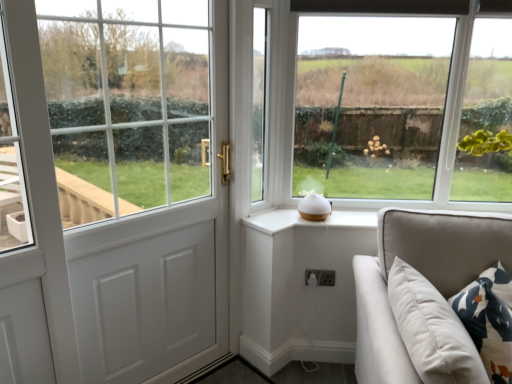
This screenshot has width=512, height=384. What do you see at coordinates (420, 272) in the screenshot?
I see `beige fabric couch at lower right` at bounding box center [420, 272].

Identify the location of white plastic electric outlet at lower center. (319, 277).

Image resolution: width=512 pixels, height=384 pixels. I want to click on beige fabric couch at lower right, so click(x=420, y=272).

Can you confirm if white glass door at left, arranged as the 1th window when viewed from the left, is thinner than white glass window at center, the 2th window viewed from the left?

Incorrect, the width of white glass door at left, arranged as the 1th window when viewed from the left, is not less than that of white glass window at center, the 2th window viewed from the left.

I want to click on window on the left side of white glass window at center, the 2th window viewed from the left, so click(x=127, y=103).

Is white glass window at center, which is the 2th window from right to left, at the back of white glass door at left, the third window when ordered from right to left?

That's not correct — white glass door at left, the third window when ordered from right to left, is not looking away from white glass window at center, which is the 2th window from right to left.

Based on their sizes in the image, would you say white glass door at left, the third window when ordered from right to left, is bigger or smaller than white glass window at center, the 2th window viewed from the left?

white glass door at left, the third window when ordered from right to left, is bigger than white glass window at center, the 2th window viewed from the left.

Are white plastic electric outlet at lower center and white glass door at left, arranged as the 1th window when viewed from the left, making contact?

white plastic electric outlet at lower center and white glass door at left, arranged as the 1th window when viewed from the left, are not in contact.

Considering the sizes of objects white plastic electric outlet at lower center and white glass door at left, arranged as the 1th window when viewed from the left, in the image provided, who is bigger, white plastic electric outlet at lower center or white glass door at left, arranged as the 1th window when viewed from the left,?

white glass door at left, arranged as the 1th window when viewed from the left, is bigger.

From a real-world perspective, is white plastic electric outlet at lower center positioned above or below white glass door at left, the third window when ordered from right to left?

Clearly, from a real-world perspective, white plastic electric outlet at lower center is below white glass door at left, the third window when ordered from right to left.

From the image's perspective, which one is positioned lower, beige fabric couch at lower right or white glass door at left, the third window when ordered from right to left?

beige fabric couch at lower right.

Is beige fabric couch at lower right completely or partially outside of white glass door at left, arranged as the 1th window when viewed from the left?

beige fabric couch at lower right is positioned outside white glass door at left, arranged as the 1th window when viewed from the left.

Does beige fabric couch at lower right appear on the right side of white glass door at left, arranged as the 1th window when viewed from the left?

Correct, you'll find beige fabric couch at lower right to the right of white glass door at left, arranged as the 1th window when viewed from the left.

Looking at this image, is white glass door at left, the third window when ordered from right to left, touching beige fabric couch at lower right?

No.

Considering the sizes of objects white glass door at left, the third window when ordered from right to left, and beige fabric couch at lower right in the image provided, who is smaller, white glass door at left, the third window when ordered from right to left, or beige fabric couch at lower right?

Smaller between the two is beige fabric couch at lower right.

Is white glass door at left, arranged as the 1th window when viewed from the left, behind beige fabric couch at lower right?

Yes, it is behind beige fabric couch at lower right.

How different are the orientations of white glass door at left, arranged as the 1th window when viewed from the left, and beige fabric couch at lower right in degrees?

12.1 degrees.

From the picture: Choose the correct answer: Is white glass door at left, arranged as the 1th window when viewed from the left, inside white plastic electric outlet at lower center or outside it?

white glass door at left, arranged as the 1th window when viewed from the left, cannot be found inside white plastic electric outlet at lower center.

From a real-world perspective, is white glass door at left, the third window when ordered from right to left, under white plastic electric outlet at lower center?

No, from a real-world perspective, white glass door at left, the third window when ordered from right to left, is not beneath white plastic electric outlet at lower center.

Considering the relative sizes of white glass door at left, arranged as the 1th window when viewed from the left, and white plastic electric outlet at lower center in the image provided, is white glass door at left, arranged as the 1th window when viewed from the left, thinner than white plastic electric outlet at lower center?

Incorrect, the width of white glass door at left, arranged as the 1th window when viewed from the left, is not less than that of white plastic electric outlet at lower center.

Is white glass door at left, the third window when ordered from right to left, aimed at white plastic electric outlet at lower center?

No, white glass door at left, the third window when ordered from right to left, is not aimed at white plastic electric outlet at lower center.

From a real-world perspective, is white plastic electric outlet at lower center physically located above or below green leafy plant at upper right, which appears as the third window when viewed from the left?

From a real-world perspective, white plastic electric outlet at lower center is physically below green leafy plant at upper right, which appears as the third window when viewed from the left.

Based on the photo, how much distance is there between white plastic electric outlet at lower center and green leafy plant at upper right, which appears as the third window when viewed from the left?

white plastic electric outlet at lower center and green leafy plant at upper right, which appears as the third window when viewed from the left, are 97.97 centimeters apart from each other.

Considering the sizes of white plastic electric outlet at lower center and green leafy plant at upper right, the first window when ordered from right to left, in the image, is white plastic electric outlet at lower center taller or shorter than green leafy plant at upper right, the first window when ordered from right to left,?

In the image, white plastic electric outlet at lower center appears to be shorter than green leafy plant at upper right, the first window when ordered from right to left.

Between point (332, 286) and point (461, 176), which one is positioned in front?

The point (461, 176) is more forward.

Visually, is white glass window at center, the 2th window viewed from the left, positioned to the left or to the right of white plastic electric outlet at lower center?

In the image, white glass window at center, the 2th window viewed from the left, appears on the right side of white plastic electric outlet at lower center.

From the image's perspective, is white glass window at center, which is the 2th window from right to left, on top of white plastic electric outlet at lower center?

Yes, from the image's perspective, white glass window at center, which is the 2th window from right to left, is on top of white plastic electric outlet at lower center.

From a real-world perspective, which is physically above, white glass window at center, the 2th window viewed from the left, or white plastic electric outlet at lower center?

From a 3D spatial view, white glass window at center, the 2th window viewed from the left, is above.

What's the angular difference between white glass window at center, the 2th window viewed from the left, and white plastic electric outlet at lower center's facing directions?

The facing directions of white glass window at center, the 2th window viewed from the left, and white plastic electric outlet at lower center are 0.569 degrees apart.

Locate an element on the screen. window that is the 2nd one when counting backward from the white glass door at left, arranged as the 1th window when viewed from the left is located at coordinates (279, 104).

I want to click on the 1st window above when counting from the white plastic electric outlet at lower center (from the image's perspective), so pos(127,103).

Based on their spatial positions, is beige fabric couch at lower right or white glass window at center, which is the 2th window from right to left, further from white glass door at left, arranged as the 1th window when viewed from the left?

beige fabric couch at lower right is further to white glass door at left, arranged as the 1th window when viewed from the left.

Looking at the image, which one is located further to green leafy plant at upper right, which appears as the third window when viewed from the left, beige fabric couch at lower right or white glass window at center, the 2th window viewed from the left?

white glass window at center, the 2th window viewed from the left, is further to green leafy plant at upper right, which appears as the third window when viewed from the left.

Estimate the real-world distances between objects in this image. Which object is further from green leafy plant at upper right, which appears as the third window when viewed from the left, white plastic electric outlet at lower center or white glass window at center, which is the 2th window from right to left?

white plastic electric outlet at lower center is positioned further to the anchor green leafy plant at upper right, which appears as the third window when viewed from the left.

Looking at the image, which one is located further to white plastic electric outlet at lower center, white glass door at left, arranged as the 1th window when viewed from the left, or beige fabric couch at lower right?

white glass door at left, arranged as the 1th window when viewed from the left, is further to white plastic electric outlet at lower center.

From the picture: Based on their spatial positions, is white glass door at left, the third window when ordered from right to left, or white glass window at center, the 2th window viewed from the left, further from beige fabric couch at lower right?

white glass door at left, the third window when ordered from right to left, is further to beige fabric couch at lower right.

Considering their positions, is white glass window at center, which is the 2th window from right to left, positioned further to beige fabric couch at lower right than white glass door at left, arranged as the 1th window when viewed from the left?

white glass door at left, arranged as the 1th window when viewed from the left, is further to beige fabric couch at lower right.

When comparing their distances from white glass window at center, the 2th window viewed from the left, does white glass door at left, arranged as the 1th window when viewed from the left, or beige fabric couch at lower right seem further?

beige fabric couch at lower right is further to white glass window at center, the 2th window viewed from the left.

Looking at the image, which one is located further to white plastic electric outlet at lower center, green leafy plant at upper right, which appears as the third window when viewed from the left, or beige fabric couch at lower right?

Based on the image, green leafy plant at upper right, which appears as the third window when viewed from the left, appears to be further to white plastic electric outlet at lower center.

The width and height of the screenshot is (512, 384). What are the coordinates of `window between white glass door at left, the third window when ordered from right to left, and green leafy plant at upper right, which appears as the third window when viewed from the left` in the screenshot? It's located at (279, 104).

Where is `electric outlet between white glass door at left, arranged as the 1th window when viewed from the left, and green leafy plant at upper right, the first window when ordered from right to left`? electric outlet between white glass door at left, arranged as the 1th window when viewed from the left, and green leafy plant at upper right, the first window when ordered from right to left is located at coordinates (319, 277).

Identify the location of studio couch between white glass door at left, the third window when ordered from right to left, and green leafy plant at upper right, which appears as the third window when viewed from the left, in the horizontal direction. (420, 272).

The width and height of the screenshot is (512, 384). What are the coordinates of `electric outlet between white glass door at left, arranged as the 1th window when viewed from the left, and beige fabric couch at lower right from left to right` in the screenshot? It's located at (319, 277).